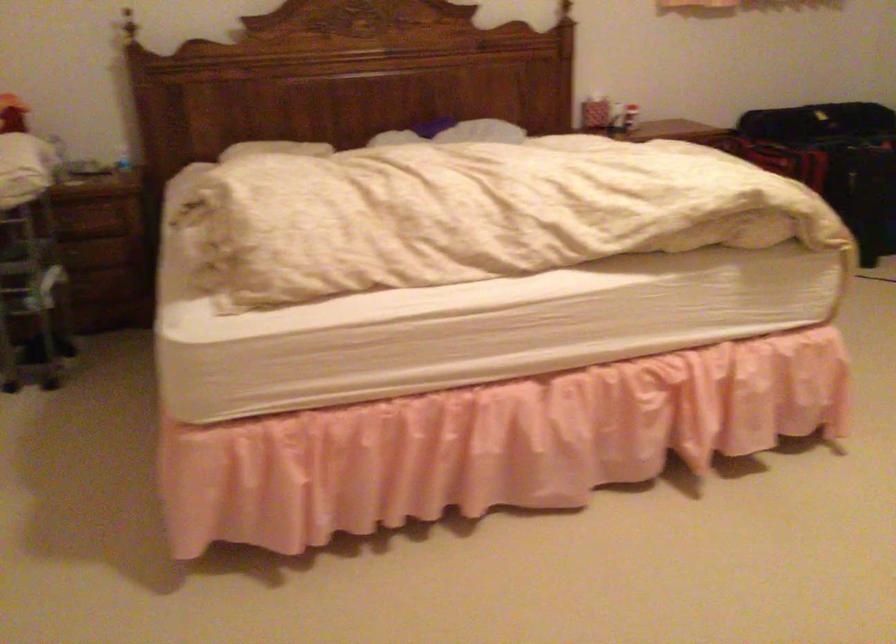
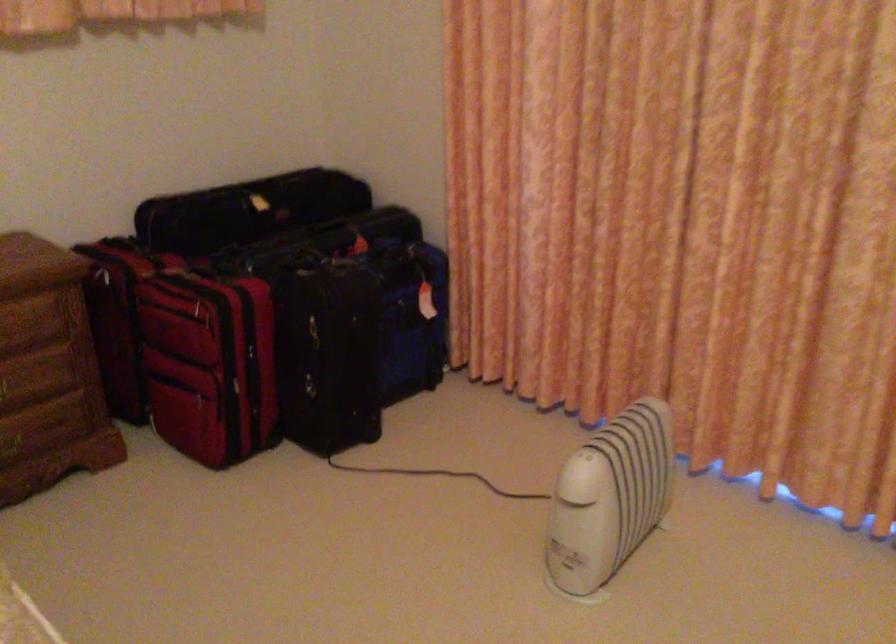
In the second image, find the point that corresponds to (788,136) in the first image.

(202, 305)